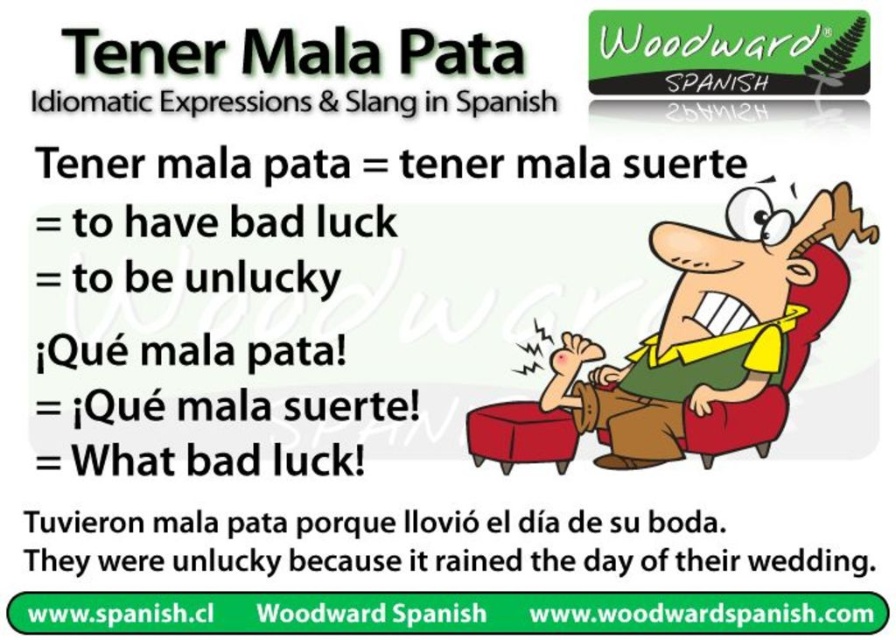
Based on the scene described, where is the green fabric shirt at upper right located in the image?

The green fabric shirt at upper right is located at point (x=716, y=337).

You are designing a poster and need to place two white paper elements. The white paper text at center and the white paper at upper center must be spaced exactly 21.87 inches apart. Given that the poster is 36 inches wide, can both elements fit horizontally without overlapping?

The distance between the white paper text at center and the white paper at upper center is 21.87 inches, which is less than the poster width of 36 inches. Therefore, both elements can fit horizontally without overlapping as long as their combined width plus the 21.87 inches spacing does not exceed 36 inches.

You are designing a poster and need to place two white paper elements. The white paper text at center and the white paper at upper center. Which of these two has a greater width?

The white paper text at center has a greater width than the white paper at upper center.